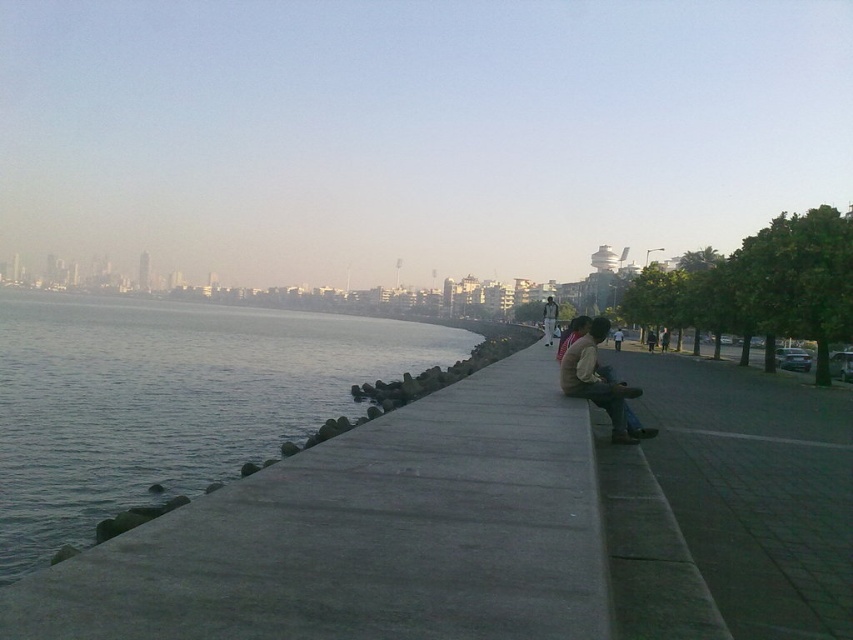
The height and width of the screenshot is (640, 853). What do you see at coordinates (598, 381) in the screenshot?
I see `brown leather jacket at center` at bounding box center [598, 381].

Which of these two, brown leather jacket at center or matte brown jacket at center, stands shorter?

With less height is brown leather jacket at center.

Which is in front, point (577, 355) or point (553, 333)?

Positioned in front is point (577, 355).

Identify the location of brown leather jacket at center. Image resolution: width=853 pixels, height=640 pixels. (598, 381).

Can you confirm if gray concrete waterway at lower left is thinner than brown leather jacket at center?

In fact, gray concrete waterway at lower left might be wider than brown leather jacket at center.

Is gray concrete waterway at lower left bigger than brown leather jacket at center?

Yes.

Is point (358, 342) positioned in front of point (593, 323)?

No, (358, 342) is further to viewer.

Locate an element on the screen. gray concrete waterway at lower left is located at coordinates (167, 401).

The width and height of the screenshot is (853, 640). I want to click on gray concrete waterway at lower left, so click(x=167, y=401).

Can you confirm if gray concrete waterway at lower left is thinner than matte brown jacket at center?

In fact, gray concrete waterway at lower left might be wider than matte brown jacket at center.

The image size is (853, 640). Identify the location of gray concrete waterway at lower left. (167, 401).

Where is `gray concrete waterway at lower left`? This screenshot has width=853, height=640. gray concrete waterway at lower left is located at coordinates (167, 401).